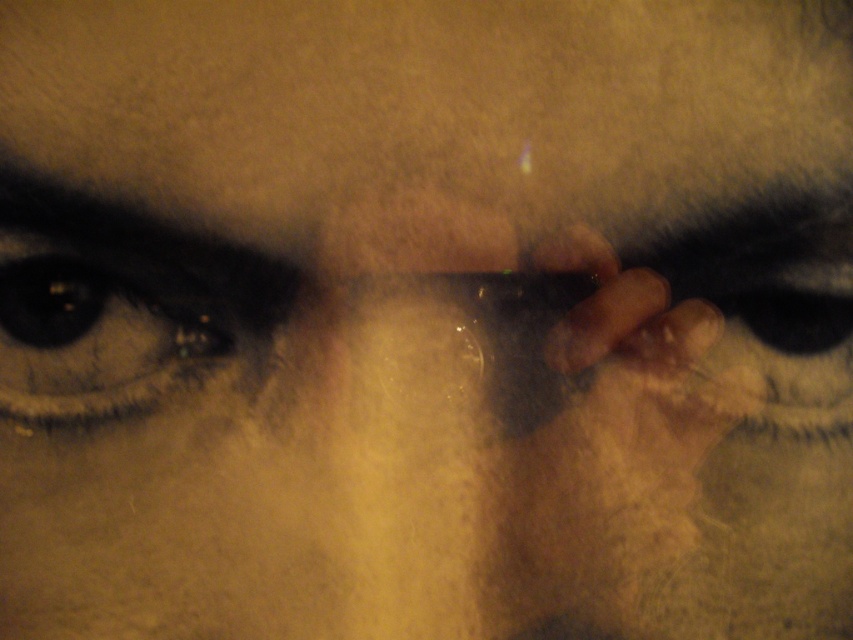
Does smooth skin at center have a larger size compared to brown matte eye at left?

Yes, smooth skin at center is bigger than brown matte eye at left.

Who is lower down, smooth skin at center or brown matte eye at left?

brown matte eye at left

Locate an element on the screen. The image size is (853, 640). smooth skin at center is located at coordinates (428, 102).

At what (x,y) coordinates should I click in order to perform the action: click on smooth skin at center. Please return your answer as a coordinate pair (x, y). Looking at the image, I should click on point(428,102).